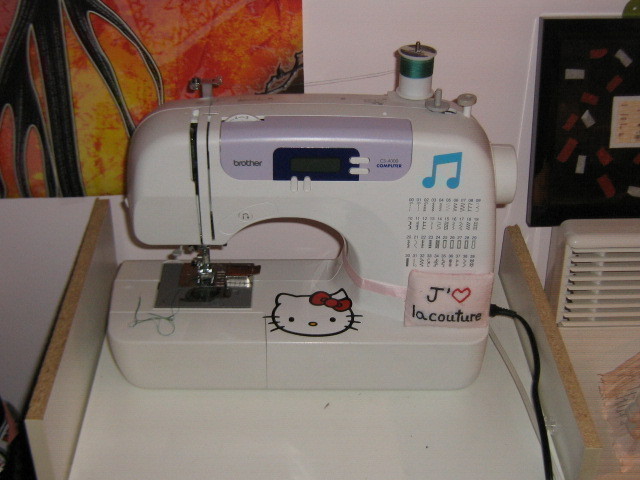
Locate an element on the screen. The width and height of the screenshot is (640, 480). painting in background is located at coordinates (189, 59).